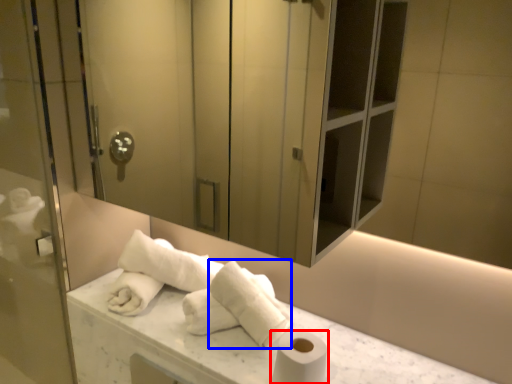
Question: Which point is further to the camera, toilet paper (highlighted by a red box) or bath towel (highlighted by a blue box)?

Choices:
 (A) toilet paper
 (B) bath towel

Answer: (B)